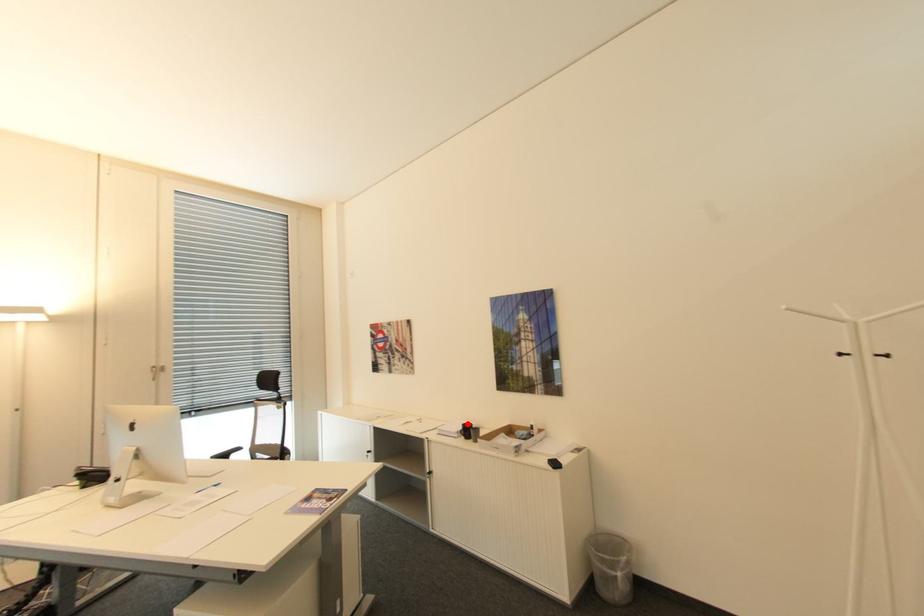
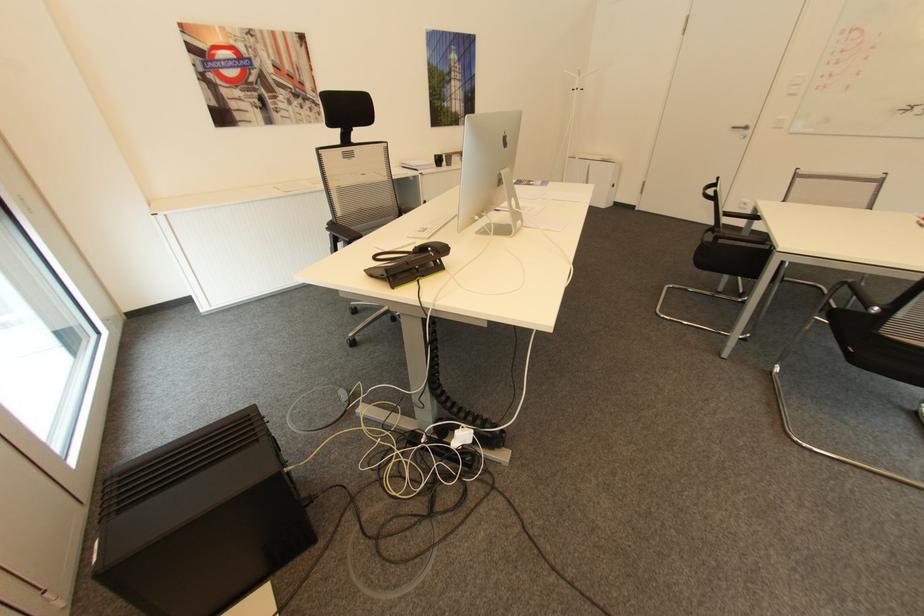
Find the pixel in the second image that matches the highlighted location in the first image.

(441, 155)